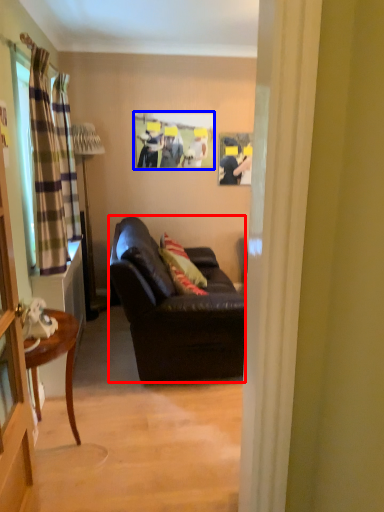
Question: Which object appears closest to the camera in this image, studio couch (highlighted by a red box) or picture frame (highlighted by a blue box)?

Choices:
 (A) studio couch
 (B) picture frame

Answer: (A)